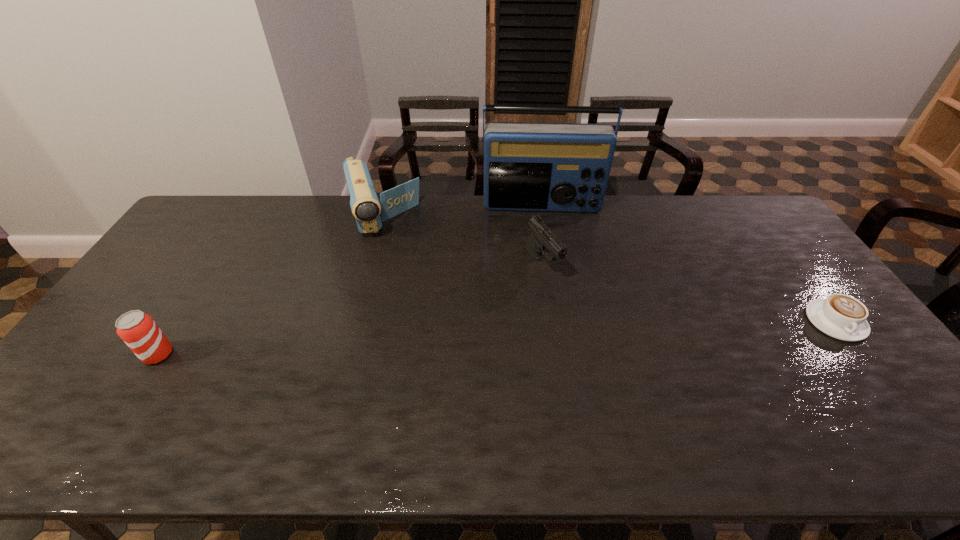
The width and height of the screenshot is (960, 540). I want to click on blank region between the leftmost object and the fourth shortest object, so click(270, 287).

Locate an element on the screen. free point between the camcorder and the pistol is located at coordinates (462, 242).

Locate an element on the screen. vacant point located between the tallest object and the cappuccino is located at coordinates (688, 264).

Where is `vacant space that's between the pistol and the nearest object`? The height and width of the screenshot is (540, 960). vacant space that's between the pistol and the nearest object is located at coordinates (350, 309).

The image size is (960, 540). Find the location of `vacant area between the pistol and the nearest object`. vacant area between the pistol and the nearest object is located at coordinates (350, 309).

Where is `free spot between the radio receiver and the nearest object`? free spot between the radio receiver and the nearest object is located at coordinates (350, 280).

Find the location of a particular element. The height and width of the screenshot is (540, 960). object that is the second closest to the radio receiver is located at coordinates (369, 212).

Identify the location of the closest object to the leftmost object. This screenshot has width=960, height=540. (x=369, y=212).